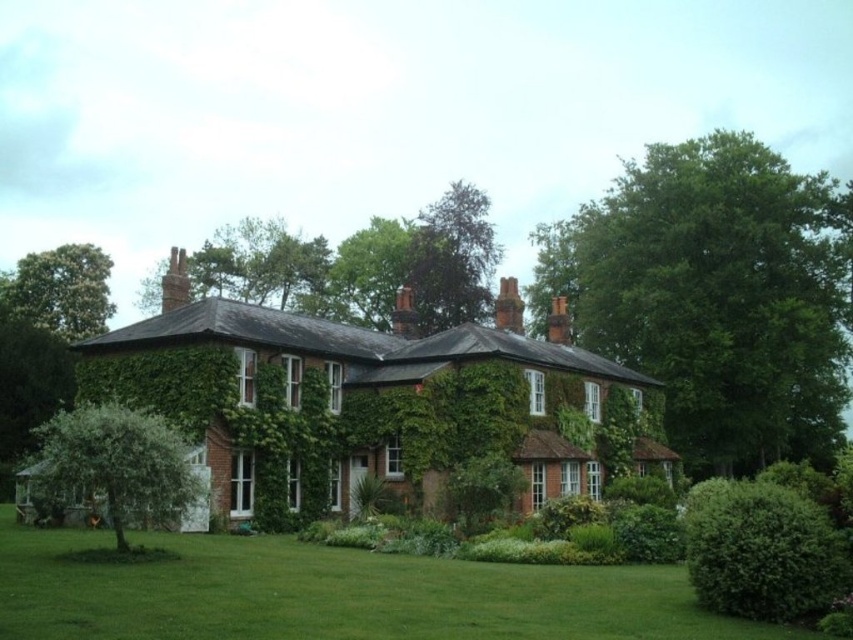
Question: Based on their relative distances, which object is farther from the green leafy tree at lower left?

Choices:
 (A) green leafy tree at upper left
 (B) smooth brick chimney at upper left
 (C) green grass at lower center
 (D) green leafy tree at upper center

Answer: (A)

Question: In this image, where is green leafy tree at upper right located relative to green leafy tree at upper left?

Choices:
 (A) left
 (B) right

Answer: (B)

Question: Considering the relative positions of green leafy tree at upper center and green leafy tree at upper left in the image provided, where is green leafy tree at upper center located with respect to green leafy tree at upper left?

Choices:
 (A) above
 (B) below

Answer: (A)

Question: Which of the following is the closest to the observer?

Choices:
 (A) (84, 257)
 (B) (172, 262)
 (C) (787, 321)
 (D) (412, 294)

Answer: (B)

Question: Estimate the real-world distances between objects in this image. Which object is farther from the green leafy tree at upper center?

Choices:
 (A) green leafy tree at upper right
 (B) red brick chimney at center
 (C) brown brick chimney at upper center
 (D) green leafy tree at upper left

Answer: (D)

Question: Is green leafy tree at upper right below green grass at lower center?

Choices:
 (A) yes
 (B) no

Answer: (B)